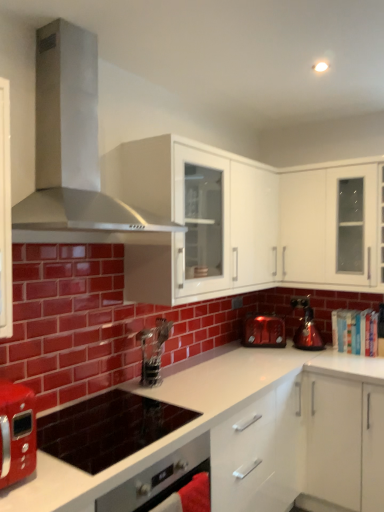
Image resolution: width=384 pixels, height=512 pixels. I want to click on vacant space underneath stainless steel range hood at upper left (from a real-world perspective), so click(x=112, y=423).